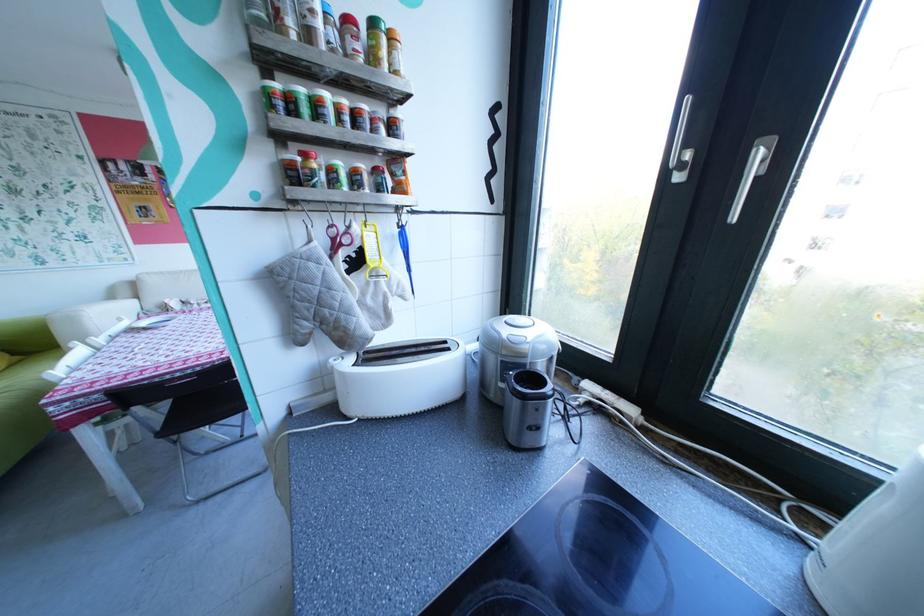
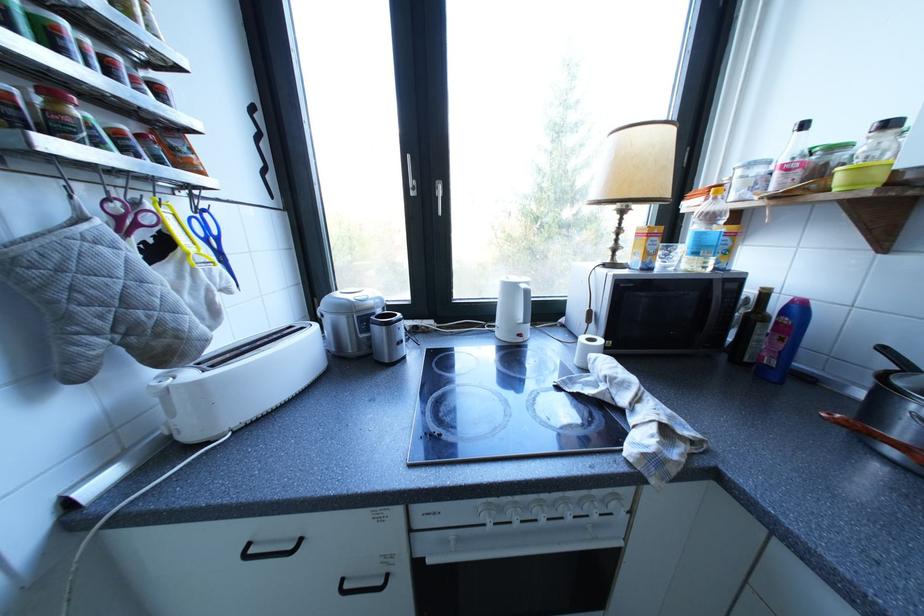
In the second image, find the point that corresponds to [355,374] in the first image.

(210, 384)